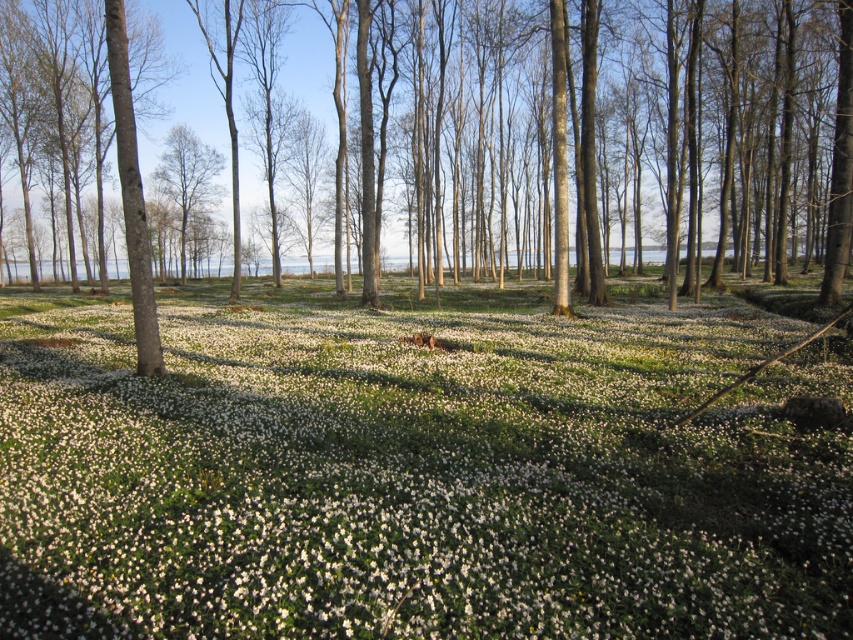
You are a gardener who wants to plant a new tree in the woodland scene. You notice the white matte flowers at center and the smooth bark tree at center. Which object is located directly above the other?

The smooth bark tree at center is directly above the white matte flowers at center because the white matte flowers at center is positioned under it.

You are a botanist studying the woodland ecosystem. You need to collect samples from the white matte flowers at center and the smooth bark tree at center. Given that your collection kit can only carry items within a 50 meter range from your current position, can you safely collect both samples without moving your kit?

The white matte flowers at center and smooth bark tree at center are 47.37 meters apart. Since your kit can carry items within 50 meters, you can safely collect both samples without moving your kit as the distance is within the 50 meter range.

You are a photographer standing in the woodland scene. You want to take a photo that focuses on the white matte flowers at center and the smooth bark tree at center. Which object should you adjust your camera focus on first to ensure both are in the frame?

You should focus on the white matte flowers at center first since they are closer to the viewer than the smooth bark tree at center, ensuring both are in the frame by adjusting the focus accordingly.